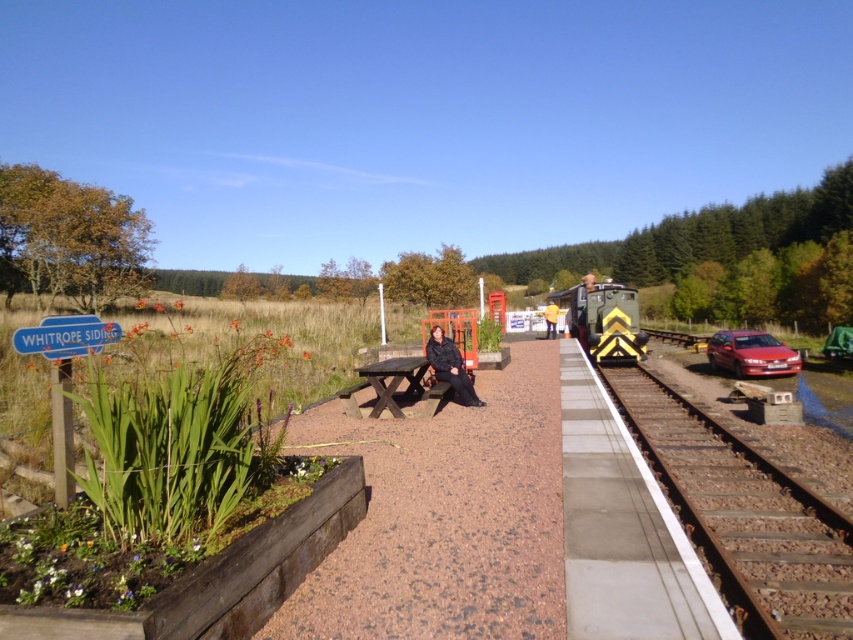
Does matte red car at right have a lesser width compared to brown wooden picnic table at center?

No.

The width and height of the screenshot is (853, 640). What do you see at coordinates (751, 353) in the screenshot?
I see `matte red car at right` at bounding box center [751, 353].

Is point (763, 355) behind point (399, 362)?

Yes, point (763, 355) is farther from viewer.

Identify the location of matte red car at right. The width and height of the screenshot is (853, 640). click(x=751, y=353).

Does rusty metal train track at right have a greater width compared to brown wooden picnic table at center?

Correct, the width of rusty metal train track at right exceeds that of brown wooden picnic table at center.

Does point (639, 420) lie behind point (393, 390)?

That is True.

The width and height of the screenshot is (853, 640). I want to click on rusty metal train track at right, so click(x=743, y=515).

Between rusty metal train track at right and black fabric jacket at center, which one has more height?

Standing taller between the two is black fabric jacket at center.

Locate an element on the screen. rusty metal train track at right is located at coordinates (743, 515).